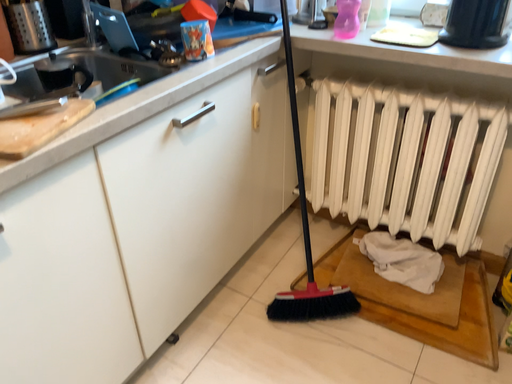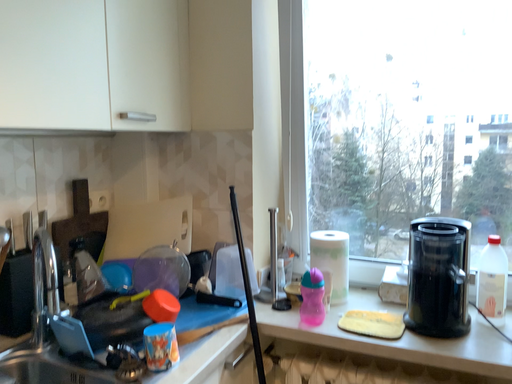
Question: Which way did the camera rotate in the video?

Choices:
 (A) rotated left
 (B) rotated right

Answer: (B)